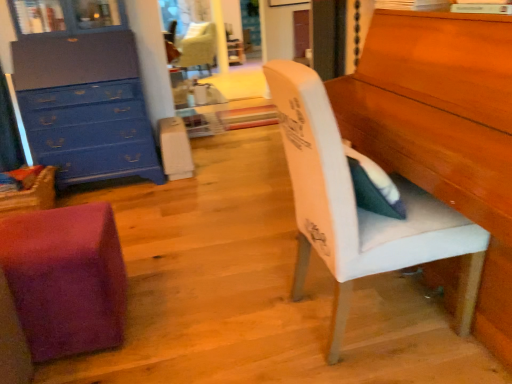
I want to click on vacant location below white fabric chair at right, arranged as the second chair when viewed from the top (from a real-world perspective), so click(349, 313).